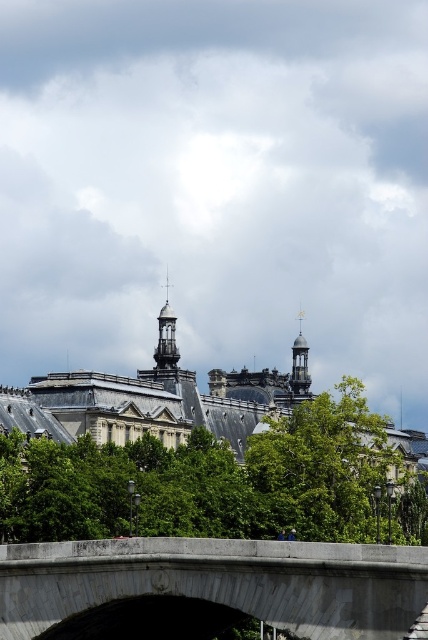
Who is more distant from viewer, (154, 355) or (303, 388)?

The point (303, 388) is more distant.

Which of these two, polished brass clock tower at center or gold metallic clock tower at upper right, stands shorter?

With less height is gold metallic clock tower at upper right.

Does point (169, 355) lie in front of point (309, 387)?

Yes, it is in front of point (309, 387).

Locate an element on the screen. polished brass clock tower at center is located at coordinates (166, 336).

Between green leafy tree at center and polished brass clock tower at center, which one is positioned lower?

green leafy tree at center is below.

Can you confirm if green leafy tree at center is positioned to the left of polished brass clock tower at center?

No, green leafy tree at center is not to the left of polished brass clock tower at center.

Where is `green leafy tree at center`? green leafy tree at center is located at coordinates tap(207, 481).

Can you confirm if gray concrete bridge at center is thinner than gold metallic clock tower at upper right?

In fact, gray concrete bridge at center might be wider than gold metallic clock tower at upper right.

From the picture: Is gray concrete bridge at center taller than gold metallic clock tower at upper right?

Incorrect, gray concrete bridge at center's height is not larger of gold metallic clock tower at upper right's.

Does point (398, 598) lie in front of point (306, 378)?

Yes, point (398, 598) is closer to viewer.

Where is `gray concrete bridge at center`? This screenshot has width=428, height=640. gray concrete bridge at center is located at coordinates (213, 582).